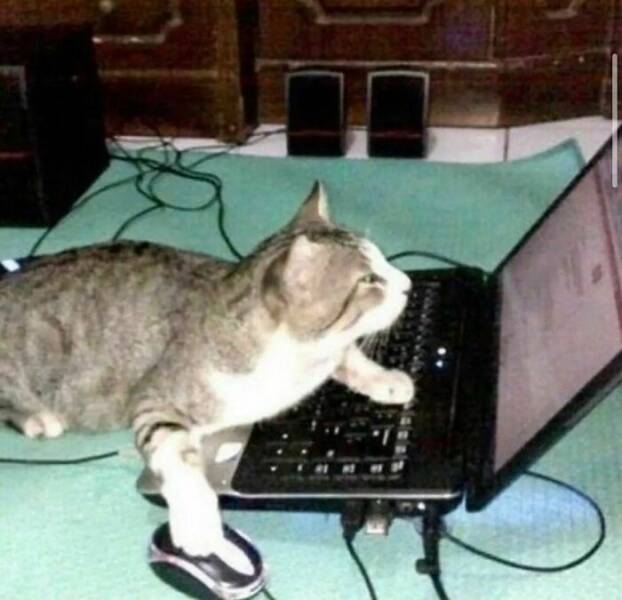
This screenshot has height=600, width=622. Identify the location of laptop keyboard. 364,434.